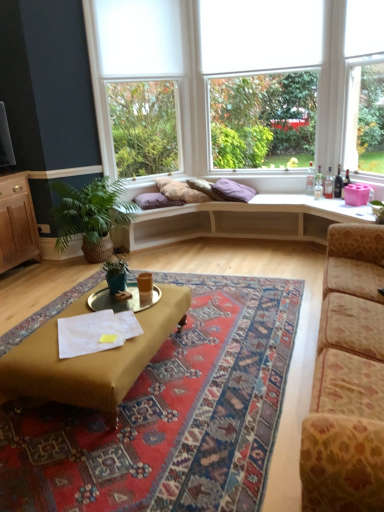
Identify the location of free spot in front of mustard fabric coffee table at center. (126, 458).